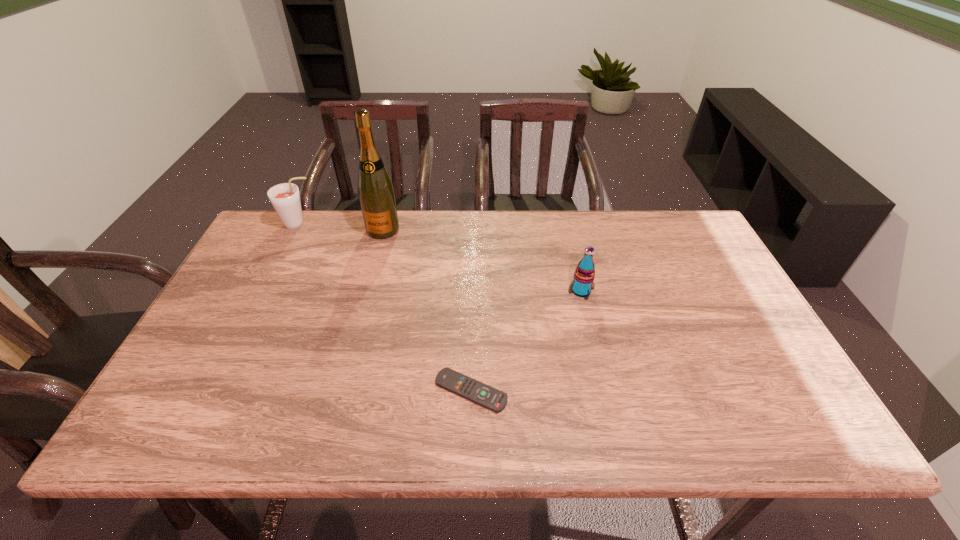
Locate an element on the screen. The height and width of the screenshot is (540, 960). vacant space at the far left corner of the desktop is located at coordinates (271, 237).

In the image, there is a desktop. Identify the location of vacant space at the near left corner. This screenshot has width=960, height=540. (191, 407).

This screenshot has height=540, width=960. In the image, there is a desktop. Identify the location of free space at the far right corner. (667, 222).

What are the coordinates of `unoccupied position between the leftmost object and the second object from right to left` in the screenshot? It's located at (385, 308).

The height and width of the screenshot is (540, 960). Find the location of `free space between the rightmost object and the leftmost object`. free space between the rightmost object and the leftmost object is located at coordinates (440, 258).

You are a GUI agent. You are given a task and a screenshot of the screen. Output one action in this format:
    pyautogui.click(x=<x>, y=<y>)
    Task: Click on the empty space between the third farthest object and the remote control
    This screenshot has width=960, height=540.
    Given the screenshot: What is the action you would take?
    click(526, 341)

Locate an element on the screen. vacant point located between the third object from left to right and the rightmost object is located at coordinates (526, 341).

The height and width of the screenshot is (540, 960). Identify the location of vacant point located between the root beer and the second object from left to right. (341, 227).

Identify the location of unoccupied position between the leftmost object and the remote control. (385, 308).

This screenshot has width=960, height=540. I want to click on free spot between the shortest object and the leftmost object, so click(x=385, y=308).